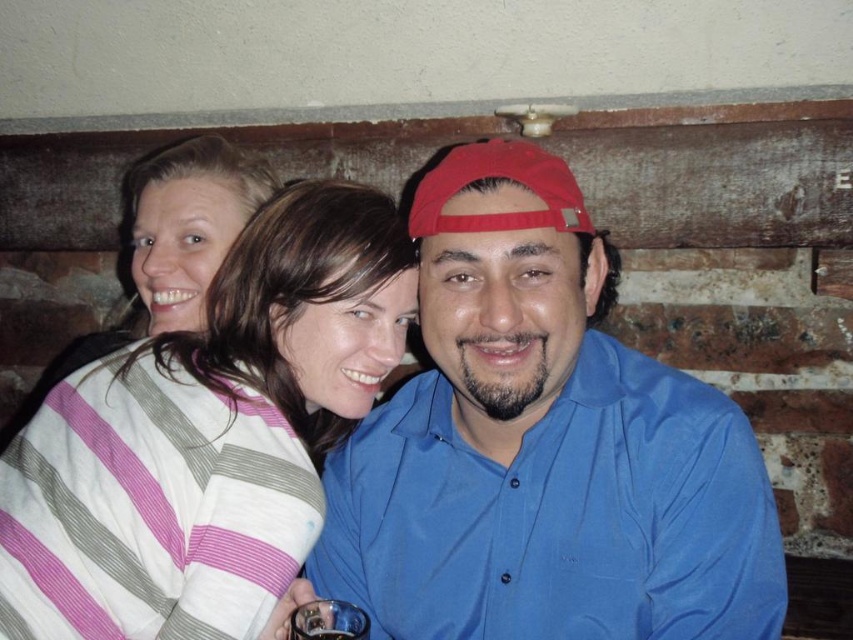
Question: Which point is farther to the camera?

Choices:
 (A) blue cotton shirt at center
 (B) striped cotton shirt at center
 (C) striped sweater at upper left

Answer: (C)

Question: Which point appears farthest from the camera in this image?

Choices:
 (A) (604, 262)
 (B) (192, 188)
 (C) (10, 621)

Answer: (B)

Question: From the image, what is the correct spatial relationship of blue cotton shirt at center in relation to striped cotton shirt at center?

Choices:
 (A) right
 (B) left

Answer: (A)

Question: Can you confirm if blue cotton shirt at center is positioned above striped sweater at upper left?

Choices:
 (A) yes
 (B) no

Answer: (B)

Question: Which object is positioned closest to the striped sweater at upper left?

Choices:
 (A) blue cotton shirt at center
 (B) striped cotton shirt at center

Answer: (B)

Question: Can you confirm if blue cotton shirt at center is positioned above striped sweater at upper left?

Choices:
 (A) yes
 (B) no

Answer: (B)